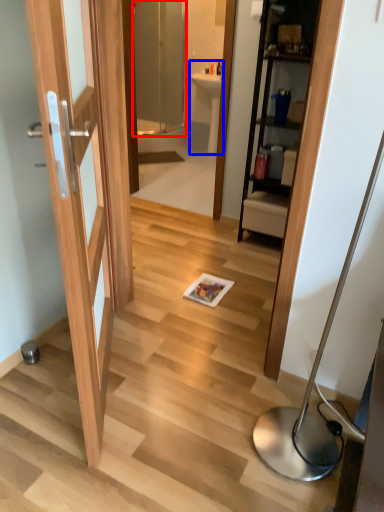
Question: Which point is further to the camera, screen door (highlighted by a red box) or sink (highlighted by a blue box)?

Choices:
 (A) screen door
 (B) sink

Answer: (B)